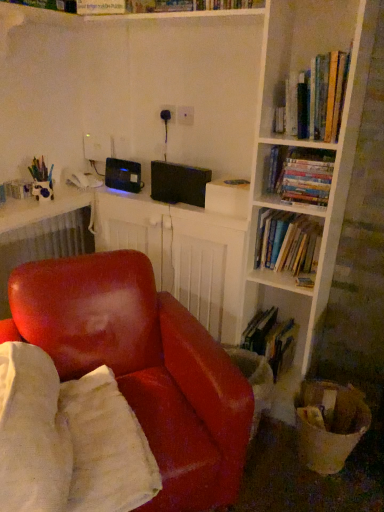
Question: Would you say hardcover books at upper right, acting as the first book starting from the top, is to the left or to the right of hardcover book at lower center, which is the first book in bottom-to-top order, in the picture?

Choices:
 (A) right
 (B) left

Answer: (A)

Question: Considering their positions, is hardcover books at upper right, acting as the first book starting from the top, located in front of or behind hardcover book at lower center, arranged as the 4th book when viewed from the top?

Choices:
 (A) behind
 (B) front

Answer: (B)

Question: Which of these objects is positioned closest to the black plastic speaker at center?

Choices:
 (A) hardcover books at upper right, acting as the first book starting from the top
 (B) hardcover book at upper center
 (C) hardcover book at lower center, arranged as the 4th book when viewed from the top
 (D) white textured radiator at upper left
 (E) black plastic computer desk at center

Answer: (B)

Question: Estimate the real-world distances between objects in this image. Which object is closer to the leather at center?

Choices:
 (A) black plastic speaker at center
 (B) hardcover book at upper center
 (C) hardcover books at upper right, acting as the first book starting from the top
 (D) white textured radiator at upper left
 (E) matte black outlet at upper center

Answer: (D)